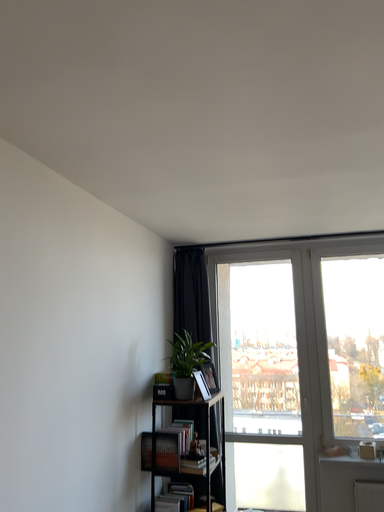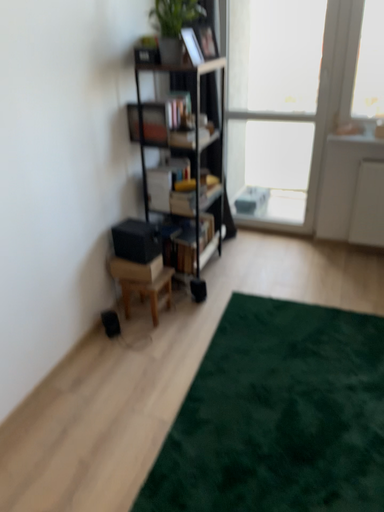
Question: Which way did the camera rotate in the video?

Choices:
 (A) rotated downward
 (B) rotated upward

Answer: (A)